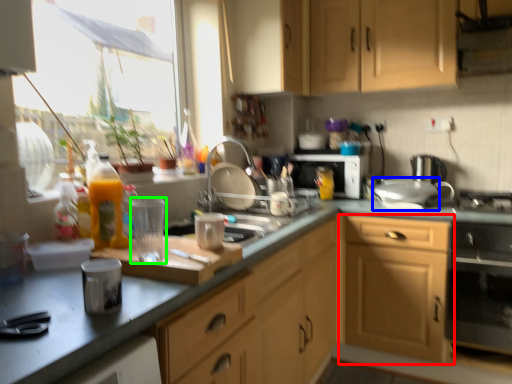
Question: Which is nearer to the cabinetry (highlighted by a red box)? appliance (highlighted by a blue box) or appliance (highlighted by a green box).

Choices:
 (A) appliance
 (B) appliance

Answer: (A)